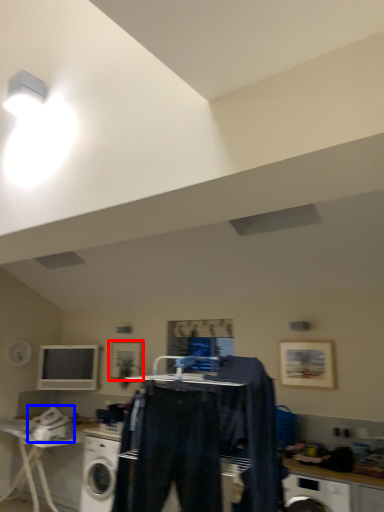
Question: Which point is closer to the camera, picture frame (highlighted by a red box) or appliance (highlighted by a blue box)?

Choices:
 (A) picture frame
 (B) appliance

Answer: (B)